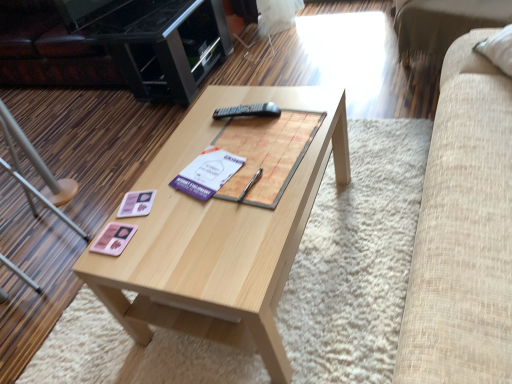
Identify the location of vacant space in front of black plastic remote at center. point(257,141).